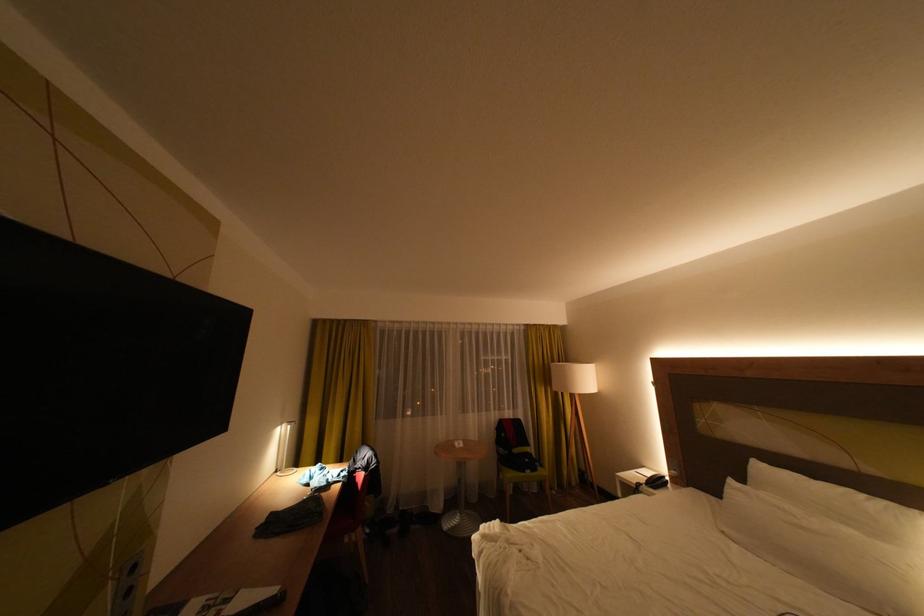
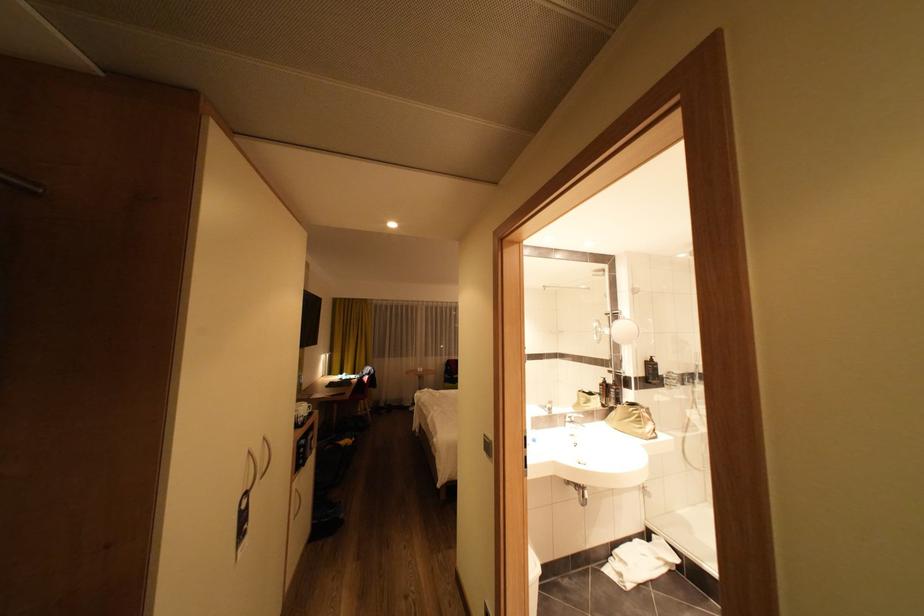
Question: What movement of the cameraman would produce the second image?

Choices:
 (A) Left
 (B) Right
 (C) Forward
 (D) Backward

Answer: (D)